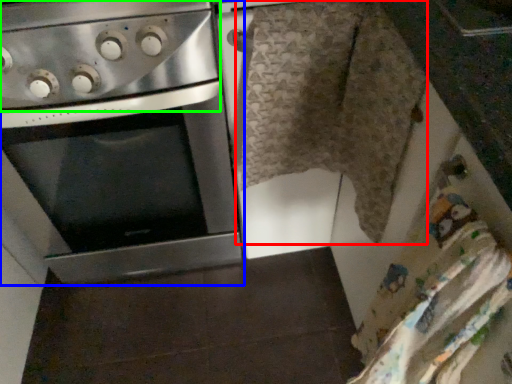
Question: Considering the real-world distances, which object is farthest from blanket (highlighted by a red box)? oven (highlighted by a blue box) or gas stove (highlighted by a green box)?

Choices:
 (A) oven
 (B) gas stove

Answer: (A)